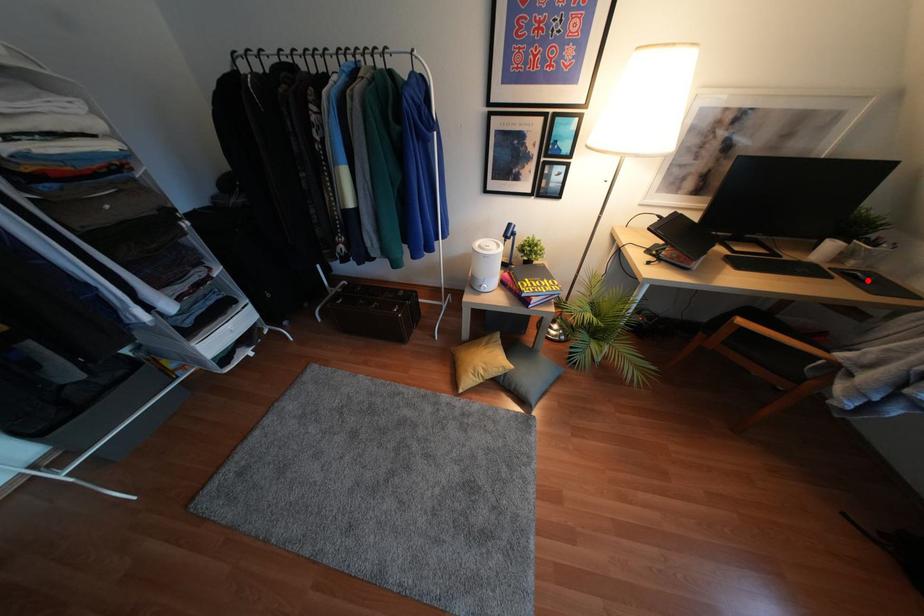
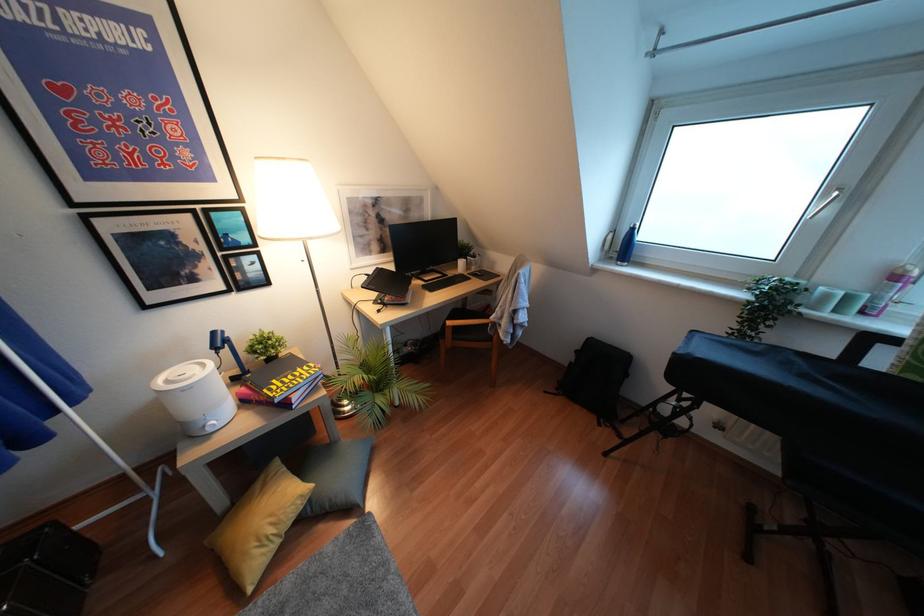
Question: I am providing you with two images of the same scene from different viewpoints. In image1, a red point is highlighted. Considering the same 3D point in image2, which of the following is correct?

Choices:
 (A) It is closer
 (B) It is farther

Answer: (A)